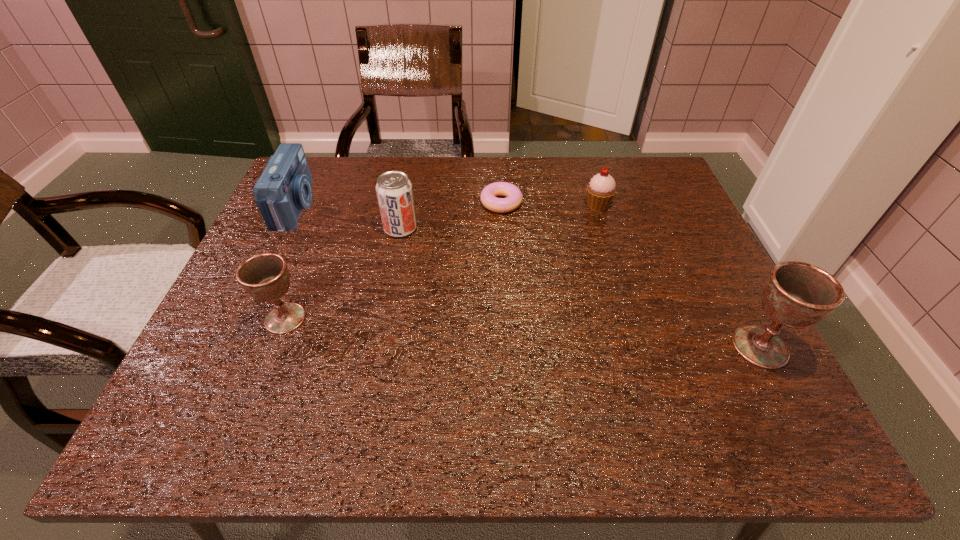
Where is `chalice that is at the left edge`? Image resolution: width=960 pixels, height=540 pixels. chalice that is at the left edge is located at coordinates (265, 277).

The image size is (960, 540). I want to click on camera that is at the left edge, so click(x=284, y=188).

The image size is (960, 540). Find the location of `object located in the right edge section of the desktop`. object located in the right edge section of the desktop is located at coordinates pyautogui.click(x=796, y=294).

This screenshot has width=960, height=540. Identify the location of object that is at the far left corner. (284, 188).

Where is `object present at the near right corner`? This screenshot has height=540, width=960. object present at the near right corner is located at coordinates (796, 294).

What are the coordinates of `free region at the far edge of the desktop` in the screenshot? It's located at [565, 193].

Find the location of `vacant space at the near edge of the desktop`. vacant space at the near edge of the desktop is located at coordinates (552, 365).

In the image, there is a desktop. Identify the location of free space at the right edge. The image size is (960, 540). (681, 214).

Image resolution: width=960 pixels, height=540 pixels. In order to click on free space at the far left corner of the desktop in this screenshot , I will do `click(321, 170)`.

The height and width of the screenshot is (540, 960). Find the location of `free space at the near left corner of the desktop`. free space at the near left corner of the desktop is located at coordinates (228, 393).